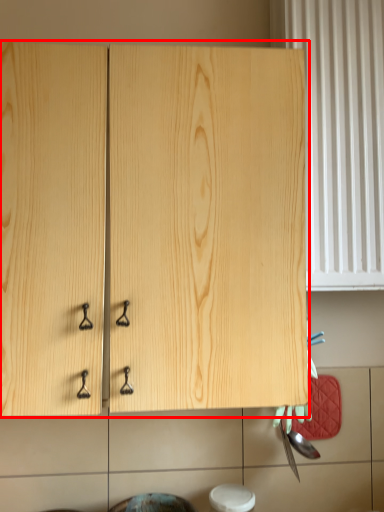
Question: Where is cabinetry (annotated by the red box) located in relation to curtain in the image?

Choices:
 (A) left
 (B) right

Answer: (A)